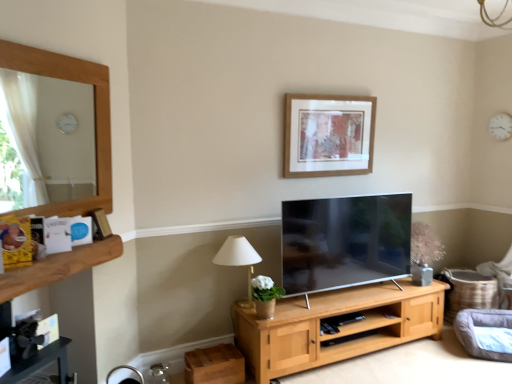
Question: Is brushed metal fireplace at lower left wider or thinner than gray fabric swivel chair at lower right?

Choices:
 (A) thin
 (B) wide

Answer: (A)

Question: Is point (97, 248) positioned closer to the camera than point (483, 357)?

Choices:
 (A) closer
 (B) farther

Answer: (A)

Question: Which object is positioned farthest from the wooden picture frame at upper center?

Choices:
 (A) gray fabric swivel chair at lower right
 (B) brown wooden shelf at left
 (C) brushed metal fireplace at lower left
 (D) white fabric lampshade at lower center
 (E) white plastic clock at upper right

Answer: (C)

Question: Based on their relative distances, which object is nearer to the wooden picture frame at upper center?

Choices:
 (A) white fabric lampshade at lower center
 (B) brushed metal fireplace at lower left
 (C) brown wooden shelf at left
 (D) white plastic clock at upper right
 (E) gray fabric swivel chair at lower right

Answer: (A)